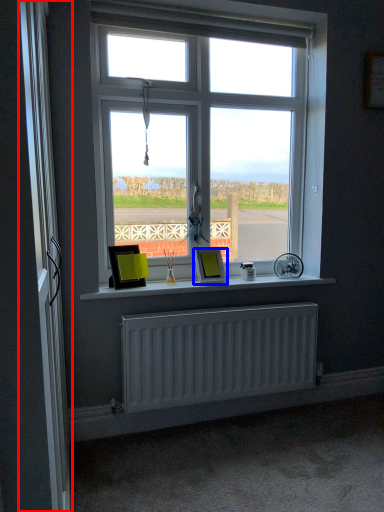
Question: Among these objects, which one is farthest to the camera, screen door (highlighted by a red box) or picture frame (highlighted by a blue box)?

Choices:
 (A) screen door
 (B) picture frame

Answer: (B)